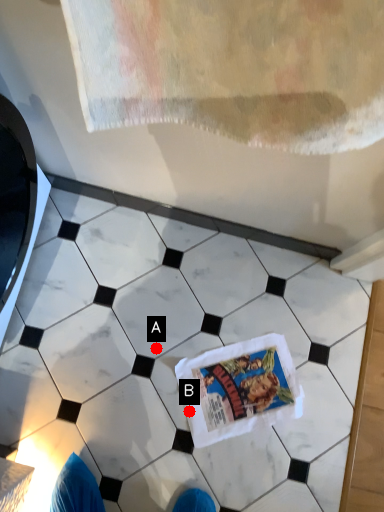
Question: Two points are circled on the image, labeled by A and B beside each circle. Which of the following is the closest to the observer?

Choices:
 (A) A is closer
 (B) B is closer

Answer: (B)